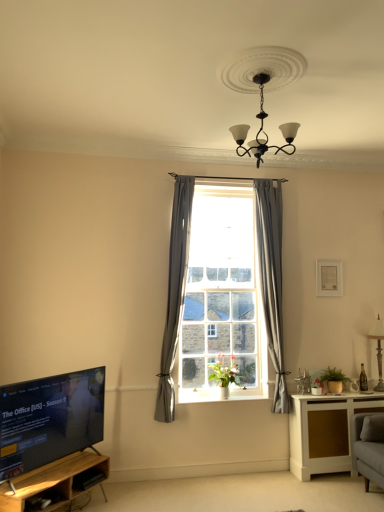
Question: From a real-world perspective, is gray fabric curtain at center, the 1th curtain positioned from the right, physically below white wood cabinet at lower right?

Choices:
 (A) no
 (B) yes

Answer: (A)

Question: Considering the relative sizes of gray fabric curtain at center, the 1th curtain positioned from the right, and white wood cabinet at lower right in the image provided, is gray fabric curtain at center, the 1th curtain positioned from the right, thinner than white wood cabinet at lower right?

Choices:
 (A) no
 (B) yes

Answer: (B)

Question: Considering the relative sizes of gray fabric curtain at center, the 1th curtain positioned from the right, and white wood cabinet at lower right in the image provided, is gray fabric curtain at center, the 1th curtain positioned from the right, bigger than white wood cabinet at lower right?

Choices:
 (A) no
 (B) yes

Answer: (A)

Question: Considering the relative sizes of gray fabric curtain at center, which ranks as the second curtain in left-to-right order, and white wood cabinet at lower right in the image provided, is gray fabric curtain at center, which ranks as the second curtain in left-to-right order, smaller than white wood cabinet at lower right?

Choices:
 (A) no
 (B) yes

Answer: (B)

Question: From a real-world perspective, is gray fabric curtain at center, the 1th curtain positioned from the right, positioned over white wood cabinet at lower right based on gravity?

Choices:
 (A) no
 (B) yes

Answer: (B)

Question: From the image's perspective, is gray fabric curtain at center, the 1th curtain positioned from the right, located beneath white wood cabinet at lower right?

Choices:
 (A) yes
 (B) no

Answer: (B)

Question: Is white wood cabinet at lower right next to green matte vase at window, positioned as the 2th plant in right-to-left order?

Choices:
 (A) no
 (B) yes

Answer: (A)

Question: Is white wood cabinet at lower right closer to the viewer compared to green matte vase at window, positioned as the 2th plant in right-to-left order?

Choices:
 (A) no
 (B) yes

Answer: (B)

Question: Can you confirm if white wood cabinet at lower right is bigger than green matte vase at window, positioned as the 2th plant in right-to-left order?

Choices:
 (A) yes
 (B) no

Answer: (A)

Question: Is white wood cabinet at lower right facing towards green matte vase at window, positioned as the 2th plant in right-to-left order?

Choices:
 (A) no
 (B) yes

Answer: (A)

Question: From the image's perspective, does white wood cabinet at lower right appear higher than green matte vase at window, arranged as the first plant when viewed from the left?

Choices:
 (A) yes
 (B) no

Answer: (B)

Question: Is green matte vase at window, positioned as the 2th plant in right-to-left order, surrounded by white wood cabinet at lower right?

Choices:
 (A) no
 (B) yes

Answer: (A)

Question: From the image's perspective, is gray fabric curtain at center, which ranks as the second curtain in left-to-right order, beneath white matte picture frame at upper right?

Choices:
 (A) yes
 (B) no

Answer: (A)